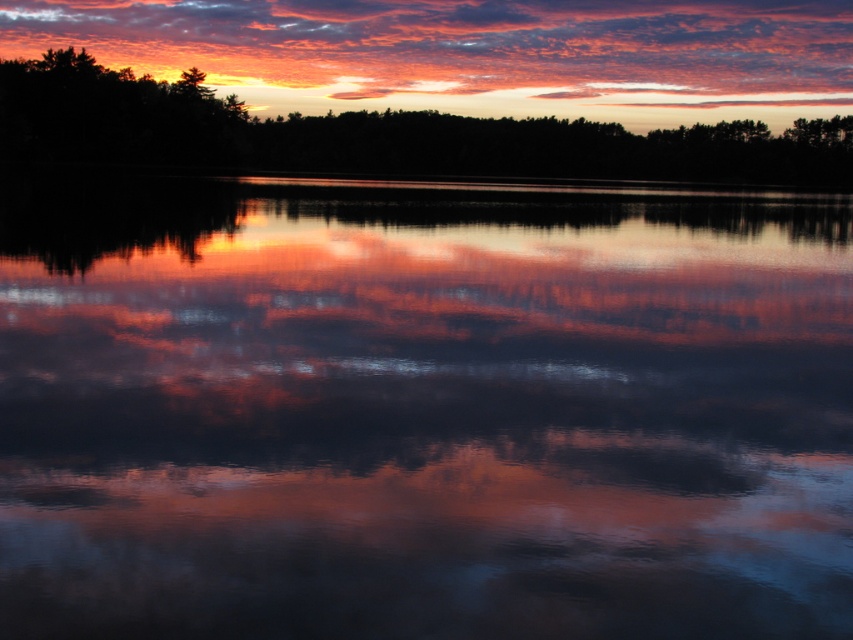
Question: Which point appears closest to the camera in this image?

Choices:
 (A) (502, 433)
 (B) (715, 166)
 (C) (471, 22)

Answer: (A)

Question: Among these points, which one is farthest from the camera?

Choices:
 (A) (112, 104)
 (B) (221, 572)

Answer: (A)

Question: In this image, where is matte orange cloud at upper center located relative to dark green leafy trees at upper center?

Choices:
 (A) above
 (B) below

Answer: (A)

Question: Which object appears farthest from the camera in this image?

Choices:
 (A) reflective water at center
 (B) matte orange cloud at upper center
 (C) dark green leafy trees at upper center

Answer: (B)

Question: Is matte orange cloud at upper center below dark green leafy trees at upper center?

Choices:
 (A) no
 (B) yes

Answer: (A)

Question: In this image, where is reflective water at center located relative to matte orange cloud at upper center?

Choices:
 (A) right
 (B) left

Answer: (B)